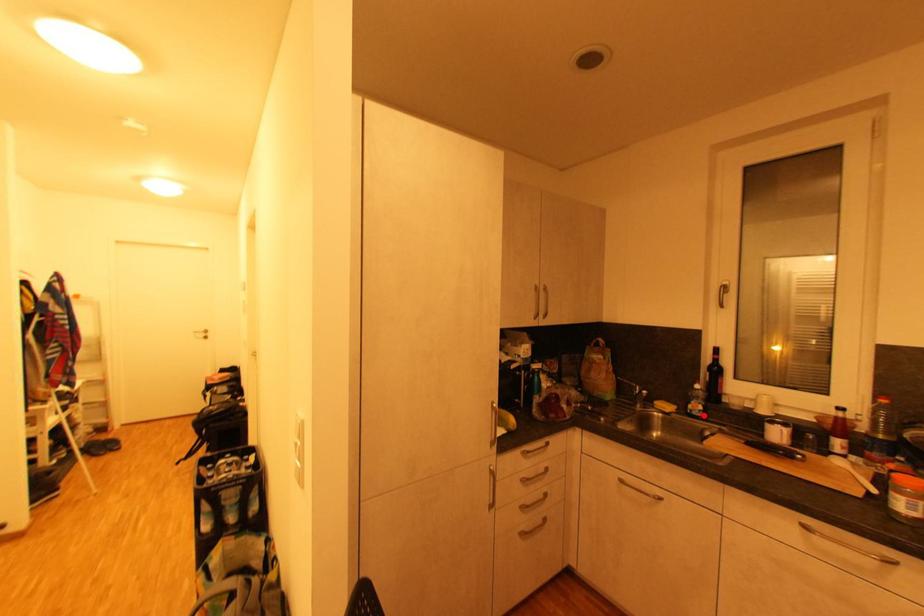
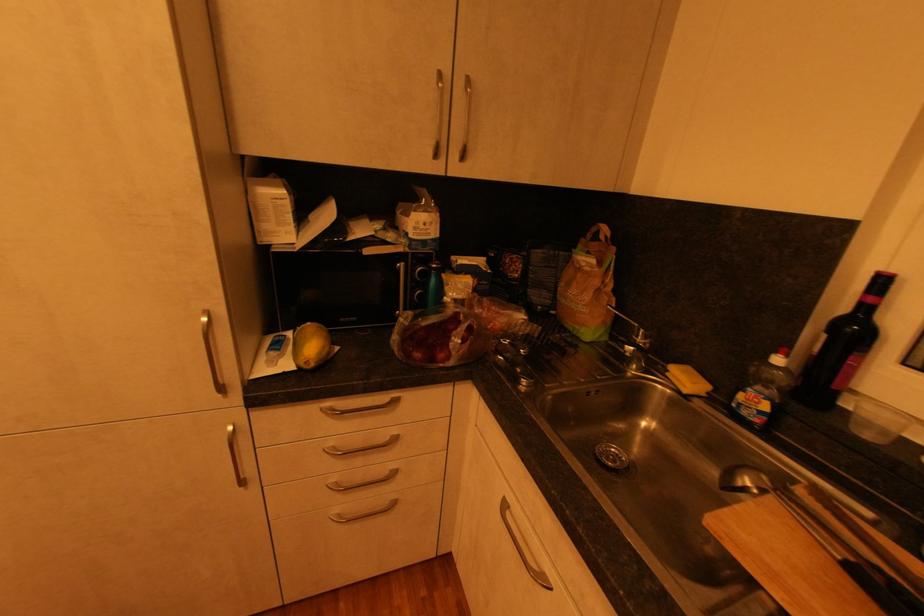
Find the pixel in the second image that matches the highlighted location in the first image.

(760, 419)